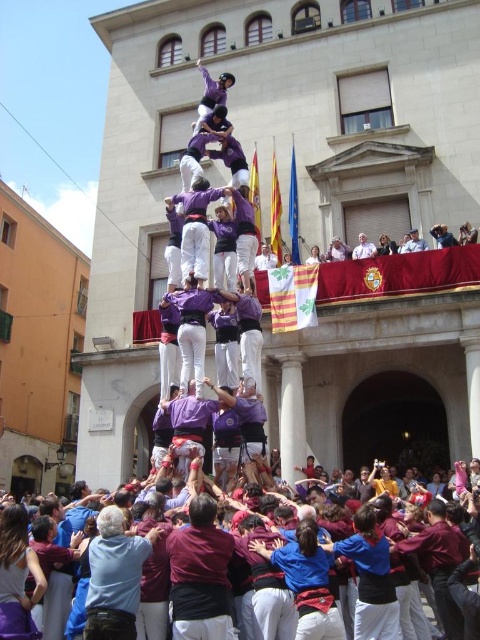
Question: Observing the image, what is the correct spatial positioning of maroon fabric crowd at lower center in reference to light gray fabric at upper center?

Choices:
 (A) left
 (B) right

Answer: (A)

Question: Which of these objects is positioned farthest from the light gray fabric at upper center?

Choices:
 (A) maroon fabric crowd at lower center
 (B) maroon fabric shirt at center
 (C) purple cotton shirt at center

Answer: (B)

Question: Which of the following is the farthest from the observer?

Choices:
 (A) (195, 432)
 (B) (175, 632)
 (C) (472, 529)

Answer: (A)

Question: Does maroon fabric shirt at center appear under light gray fabric at upper center?

Choices:
 (A) no
 (B) yes

Answer: (B)

Question: Which object is the closest to the maroon fabric shirt at center?

Choices:
 (A) maroon fabric crowd at lower center
 (B) purple cotton shirt at center
 (C) light gray fabric at upper center

Answer: (A)

Question: Is maroon fabric shirt at center further to camera compared to maroon fabric crowd at lower center?

Choices:
 (A) yes
 (B) no

Answer: (B)